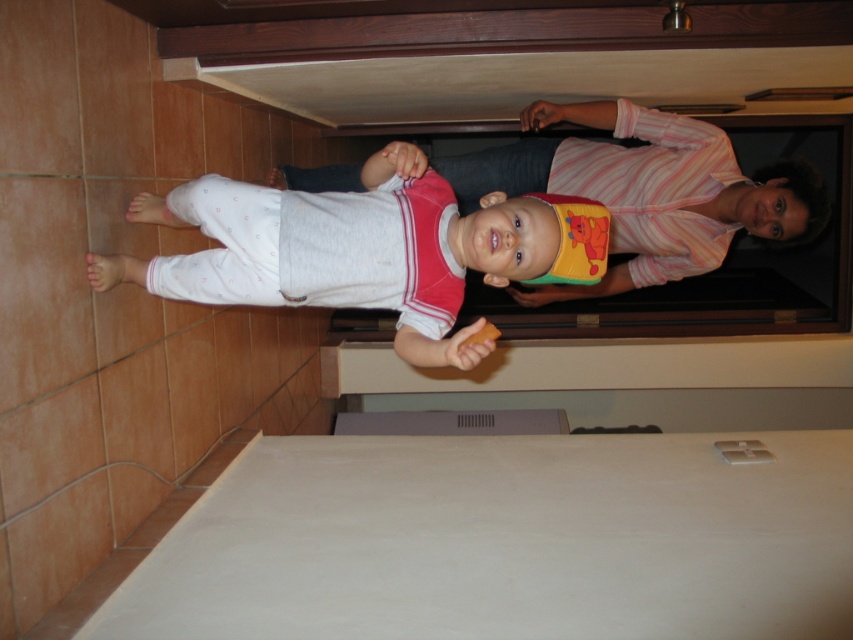
Question: Which of the following is the closest to the observer?

Choices:
 (A) (712, 256)
 (B) (408, 298)

Answer: (B)

Question: Which object appears farthest from the camera in this image?

Choices:
 (A) white cotton bib at center
 (B) white soft baby at center

Answer: (A)

Question: Is white soft baby at center to the right of white cotton bib at center from the viewer's perspective?

Choices:
 (A) yes
 (B) no

Answer: (B)

Question: Where is white soft baby at center located in relation to white cotton bib at center in the image?

Choices:
 (A) above
 (B) below

Answer: (B)

Question: Does white soft baby at center have a lesser width compared to white cotton bib at center?

Choices:
 (A) yes
 (B) no

Answer: (A)